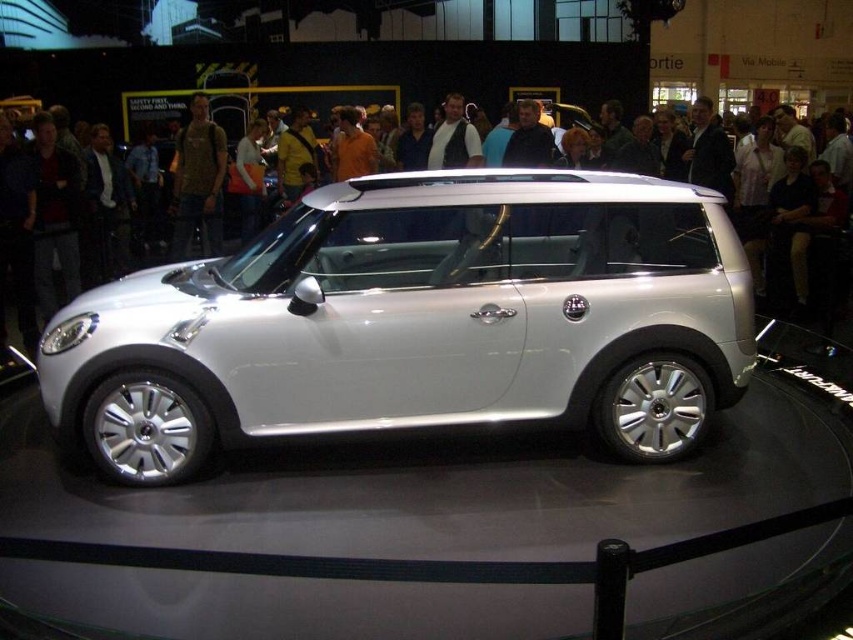
Is white metallic car at center smaller than matte white car at center?

No, white metallic car at center is not smaller than matte white car at center.

Which is behind, point (236, 381) or point (618, 225)?

Point (618, 225)

Between point (289, 339) and point (375, 218), which one is positioned in front?

Positioned in front is point (289, 339).

Find the location of `white metallic car at center`. white metallic car at center is located at coordinates (416, 321).